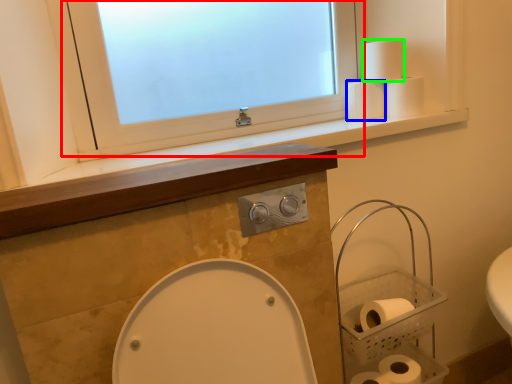
Question: Estimate the real-world distances between objects in this image. Which object is closer to window (highlighted by a red box), toilet paper (highlighted by a blue box) or toilet paper (highlighted by a green box)?

Choices:
 (A) toilet paper
 (B) toilet paper

Answer: (A)